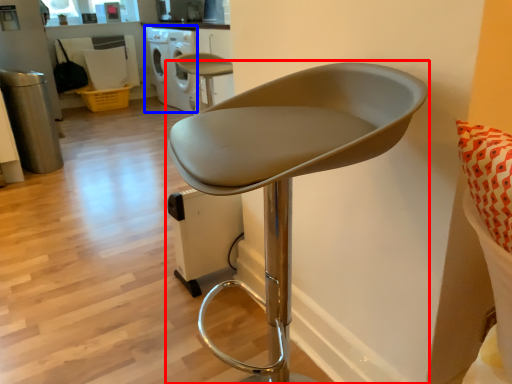
Question: Which point is closer to the camera, chair (highlighted by a red box) or dish washer (highlighted by a blue box)?

Choices:
 (A) chair
 (B) dish washer

Answer: (A)